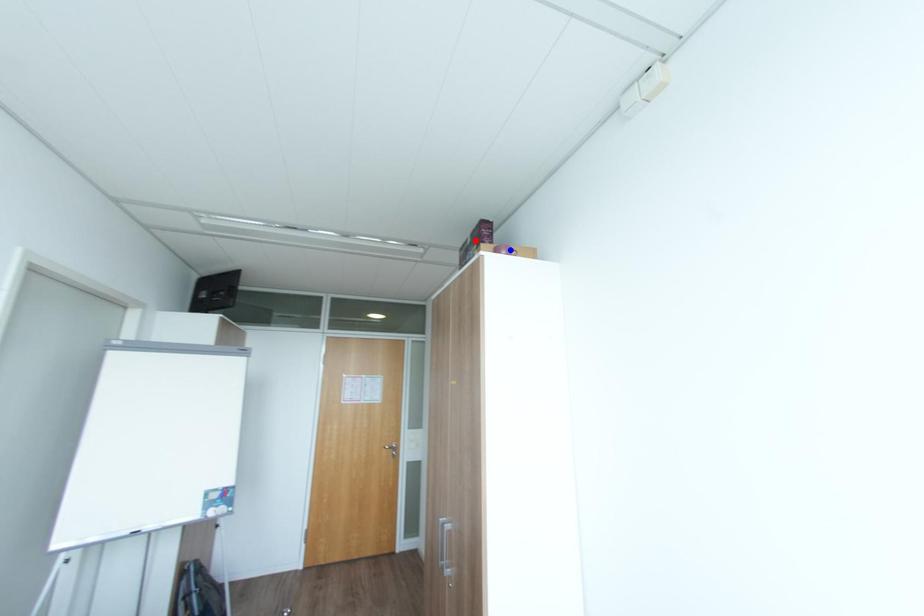
Question: Two points are marked on the image. Which point is closer to the camera?

Choices:
 (A) Blue point is closer.
 (B) Red point is closer.

Answer: (A)